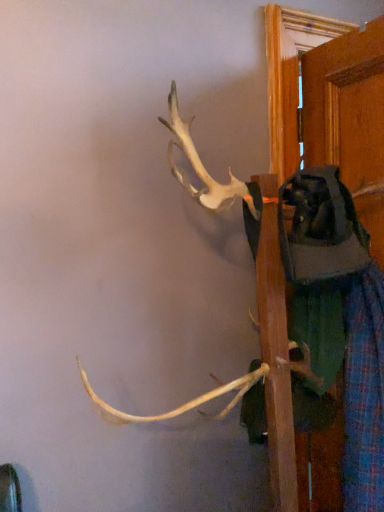
Question: Which is correct: plaid fabric pants at right is inside wooden door at right, or outside of it?

Choices:
 (A) outside
 (B) inside

Answer: (A)

Question: In terms of width, does plaid fabric pants at right look wider or thinner when compared to wooden door at right?

Choices:
 (A) wide
 (B) thin

Answer: (A)

Question: Considering the positions of plaid fabric pants at right and wooden door at right in the image, is plaid fabric pants at right bigger or smaller than wooden door at right?

Choices:
 (A) big
 (B) small

Answer: (A)

Question: In the image, is wooden door at right on the left side or the right side of plaid fabric pants at right?

Choices:
 (A) right
 (B) left

Answer: (A)

Question: From the image's perspective, is wooden door at right positioned above or below plaid fabric pants at right?

Choices:
 (A) above
 (B) below

Answer: (A)

Question: Based on their sizes in the image, would you say wooden door at right is bigger or smaller than plaid fabric pants at right?

Choices:
 (A) small
 (B) big

Answer: (A)

Question: Considering the positions of wooden door at right and plaid fabric pants at right in the image, is wooden door at right taller or shorter than plaid fabric pants at right?

Choices:
 (A) short
 (B) tall

Answer: (B)